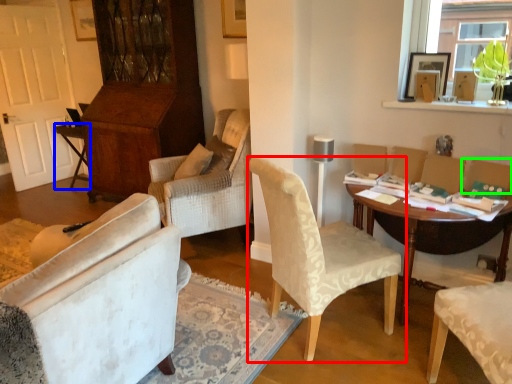
Question: Estimate the real-world distances between objects in this image. Which object is farther from chair (highlighted by a red box), table (highlighted by a blue box) or armchair (highlighted by a green box)?

Choices:
 (A) table
 (B) armchair

Answer: (A)